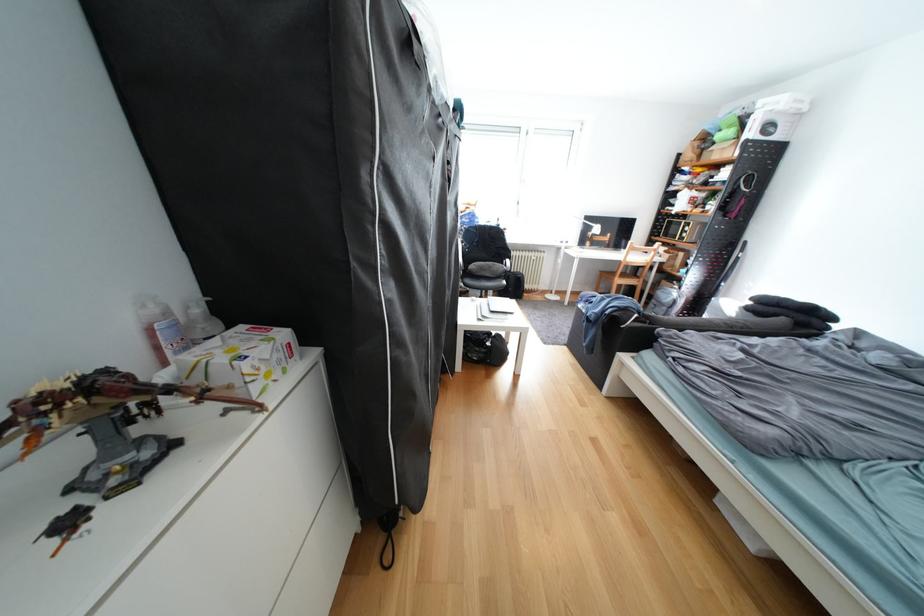
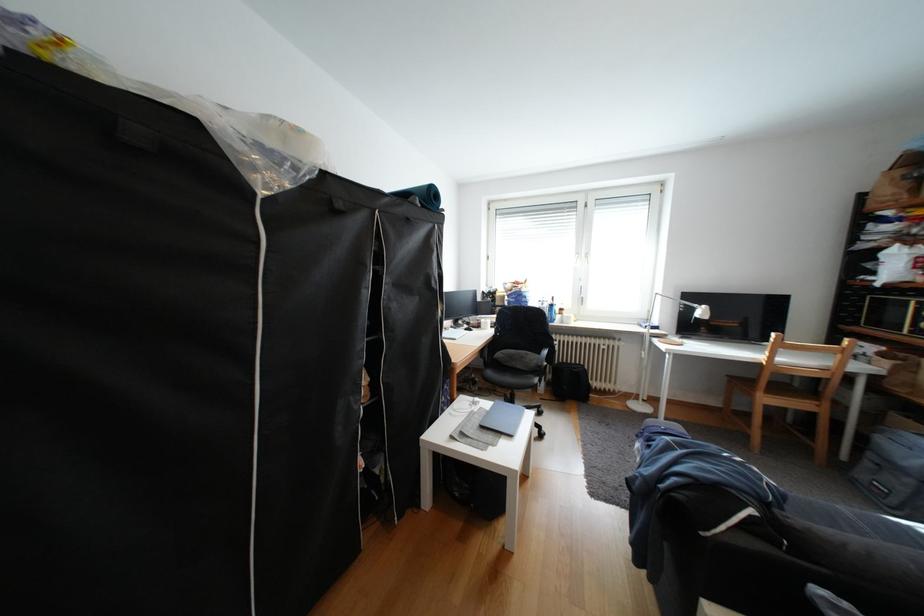
The images are taken continuously from a first-person perspective. In which direction is your viewpoint rotating?

The camera rotated toward left-up.